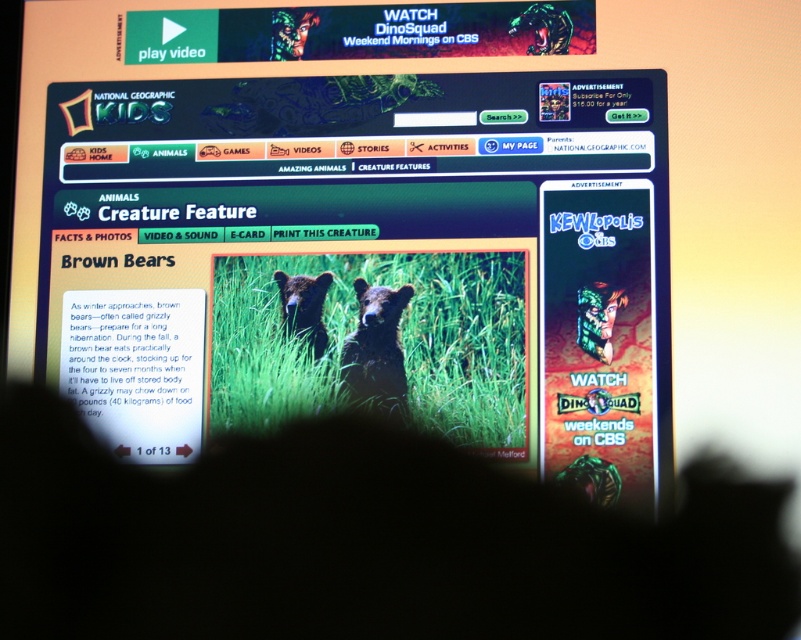
Question: Which of the following is the farthest from the observer?

Choices:
 (A) (316, 292)
 (B) (364, 353)
 (C) (242, 260)

Answer: (C)

Question: Which is farther from the soft brown fur bear at center?

Choices:
 (A) brown furry bear at center
 (B) green grass at center

Answer: (A)

Question: Does green grass at center have a larger size compared to brown furry bear at center?

Choices:
 (A) no
 (B) yes

Answer: (B)

Question: Which point is closer to the camera?

Choices:
 (A) (375, 404)
 (B) (323, 300)
 (C) (518, 444)

Answer: (C)

Question: Is green grass at center above soft brown fur bear at center?

Choices:
 (A) yes
 (B) no

Answer: (B)

Question: Is green grass at center wider than brown furry bear at center?

Choices:
 (A) yes
 (B) no

Answer: (A)